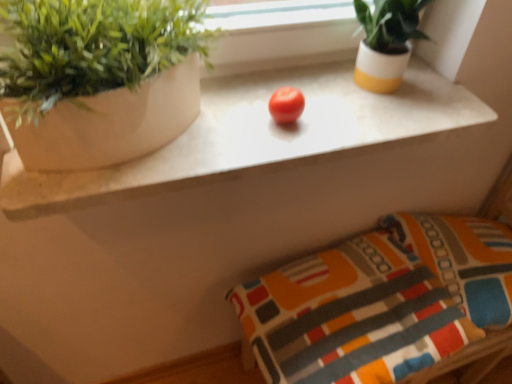
Describe the element at coordinates (386, 42) in the screenshot. I see `white glossy pot at upper right` at that location.

In order to face matte white pot at upper left, should I rotate leftwards or rightwards?

Turn left by 19.639 degrees to look at matte white pot at upper left.

Describe the element at coordinates (462, 260) in the screenshot. I see `textured cotton pillow at lower right, acting as the first pillow starting from the right` at that location.

Locate an element on the screen. The image size is (512, 384). textured cotton pillow at lower right, acting as the first pillow starting from the right is located at coordinates pos(462,260).

The width and height of the screenshot is (512, 384). I want to click on white marble counter at center, so click(x=259, y=136).

Where is `houseplant above the white marble counter at center (from the image's perspective)`? This screenshot has height=384, width=512. houseplant above the white marble counter at center (from the image's perspective) is located at coordinates (386, 42).

Considering the sizes of objects white marble counter at center and white glossy pot at upper right in the image provided, who is wider, white marble counter at center or white glossy pot at upper right?

Wider between the two is white marble counter at center.

Is white marble counter at center not within white glossy pot at upper right?

Yes, white marble counter at center is outside of white glossy pot at upper right.

From a real-world perspective, which object rests below the other?

textured cotton pillow at lower right, acting as the first pillow starting from the right, is physically lower.

Locate an element on the screen. pillow above the textured cotton pillow at lower right, which ranks as the second pillow in left-to-right order (from a real-world perspective) is located at coordinates (380, 301).

Considering the sizes of textured fabric pillow at lower right, acting as the 2th pillow starting from the right, and textured cotton pillow at lower right, which ranks as the second pillow in left-to-right order, in the image, is textured fabric pillow at lower right, acting as the 2th pillow starting from the right, wider or thinner than textured cotton pillow at lower right, which ranks as the second pillow in left-to-right order,?

In the image, textured fabric pillow at lower right, acting as the 2th pillow starting from the right, appears to be wider than textured cotton pillow at lower right, which ranks as the second pillow in left-to-right order.

How many degrees apart are the facing directions of textured fabric pillow at lower right, the first pillow when ordered from left to right, and textured cotton pillow at lower right, which ranks as the second pillow in left-to-right order?

12.3 degrees.

Which is in front, white glossy pot at upper right or textured fabric pillow at lower right, acting as the 2th pillow starting from the right?

white glossy pot at upper right is in front.

Is white glossy pot at upper right far from textured fabric pillow at lower right, acting as the 2th pillow starting from the right?

Actually, white glossy pot at upper right and textured fabric pillow at lower right, acting as the 2th pillow starting from the right, are a little close together.

Is white glossy pot at upper right spatially inside textured fabric pillow at lower right, acting as the 2th pillow starting from the right, or outside of it?

The correct answer is: outside.

Considering their positions, is white marble counter at center located in front of or behind matte white pot at upper left?

Clearly, white marble counter at center is behind matte white pot at upper left.

From the image's perspective, is white marble counter at center positioned above or below matte white pot at upper left?

From the image's perspective, white marble counter at center appears below matte white pot at upper left.

Considering the relative sizes of white marble counter at center and matte white pot at upper left in the image provided, is white marble counter at center thinner than matte white pot at upper left?

In fact, white marble counter at center might be wider than matte white pot at upper left.

What's the angular difference between white marble counter at center and matte white pot at upper left's facing directions?

The angular difference between white marble counter at center and matte white pot at upper left is 0.72 degrees.

Considering the sizes of red matte tomato at center and textured cotton pillow at lower right, acting as the first pillow starting from the right, in the image, is red matte tomato at center wider or thinner than textured cotton pillow at lower right, acting as the first pillow starting from the right,?

Clearly, red matte tomato at center has less width compared to textured cotton pillow at lower right, acting as the first pillow starting from the right.

Is red matte tomato at center not near textured cotton pillow at lower right, acting as the first pillow starting from the right?

No, red matte tomato at center is not far from textured cotton pillow at lower right, acting as the first pillow starting from the right.

From a real-world perspective, which object stands above the other?

From a 3D spatial view, matte white pot at upper left is above.

Relative to matte white pot at upper left, is red matte tomato at center in front or behind?

red matte tomato at center is behind matte white pot at upper left.

Where is `plant above the red matte tomato at center (from the image's perspective)`? Image resolution: width=512 pixels, height=384 pixels. plant above the red matte tomato at center (from the image's perspective) is located at coordinates (93, 48).

Considering the sizes of white glossy pot at upper right and matte white pot at upper left in the image, is white glossy pot at upper right bigger or smaller than matte white pot at upper left?

Clearly, white glossy pot at upper right is smaller in size than matte white pot at upper left.

Which of these two, white glossy pot at upper right or matte white pot at upper left, is thinner?

white glossy pot at upper right.

Would you consider white glossy pot at upper right to be distant from matte white pot at upper left?

No.

Could you tell me if white glossy pot at upper right is turned towards matte white pot at upper left?

No, white glossy pot at upper right is not oriented towards matte white pot at upper left.

This screenshot has width=512, height=384. Identify the location of counter located on the left of white glossy pot at upper right. (259, 136).

Where is `pillow located on the right of textured fabric pillow at lower right, acting as the 2th pillow starting from the right`? This screenshot has width=512, height=384. pillow located on the right of textured fabric pillow at lower right, acting as the 2th pillow starting from the right is located at coordinates (462, 260).

When comparing their distances from matte white pot at upper left, does red matte tomato at center or white glossy pot at upper right seem closer?

Based on the image, red matte tomato at center appears to be nearer to matte white pot at upper left.

From the picture: Which object lies further to the anchor point matte white pot at upper left, white marble counter at center or textured cotton pillow at lower right, acting as the first pillow starting from the right?

Among the two, textured cotton pillow at lower right, acting as the first pillow starting from the right, is located further to matte white pot at upper left.

When comparing their distances from white marble counter at center, does textured cotton pillow at lower right, which ranks as the second pillow in left-to-right order, or white glossy pot at upper right seem closer?

Based on the image, white glossy pot at upper right appears to be nearer to white marble counter at center.

Which object lies further to the anchor point red matte tomato at center, white glossy pot at upper right or white marble counter at center?

white glossy pot at upper right is positioned further to the anchor red matte tomato at center.

Considering their positions, is textured cotton pillow at lower right, acting as the first pillow starting from the right, positioned further to textured fabric pillow at lower right, acting as the 2th pillow starting from the right, than matte white pot at upper left?

matte white pot at upper left.

Looking at this image, based on their spatial positions, is matte white pot at upper left or white glossy pot at upper right closer to white marble counter at center?

white glossy pot at upper right is positioned closer to the anchor white marble counter at center.

Considering their positions, is textured cotton pillow at lower right, acting as the first pillow starting from the right, positioned further to matte white pot at upper left than textured fabric pillow at lower right, acting as the 2th pillow starting from the right?

textured cotton pillow at lower right, acting as the first pillow starting from the right.

When comparing their distances from textured fabric pillow at lower right, the first pillow when ordered from left to right, does white glossy pot at upper right or red matte tomato at center seem further?

red matte tomato at center is positioned further to the anchor textured fabric pillow at lower right, the first pillow when ordered from left to right.

Locate an element on the screen. houseplant situated between matte white pot at upper left and textured cotton pillow at lower right, which ranks as the second pillow in left-to-right order, from left to right is located at coordinates (386, 42).

The image size is (512, 384). Find the location of `fruit located between matte white pot at upper left and white glossy pot at upper right in the left-right direction`. fruit located between matte white pot at upper left and white glossy pot at upper right in the left-right direction is located at coordinates (286, 105).

Find the location of `counter between matte white pot at upper left and white glossy pot at upper right from left to right`. counter between matte white pot at upper left and white glossy pot at upper right from left to right is located at coordinates (259, 136).

The width and height of the screenshot is (512, 384). I want to click on counter between matte white pot at upper left and textured fabric pillow at lower right, the first pillow when ordered from left to right, from top to bottom, so click(259, 136).